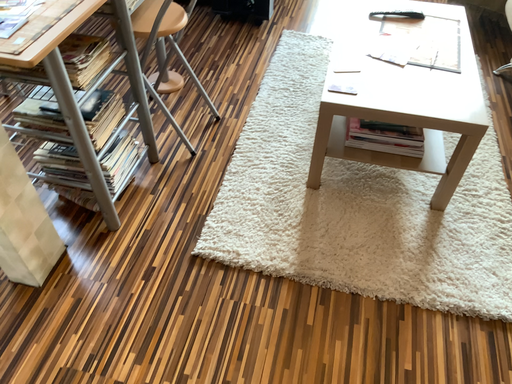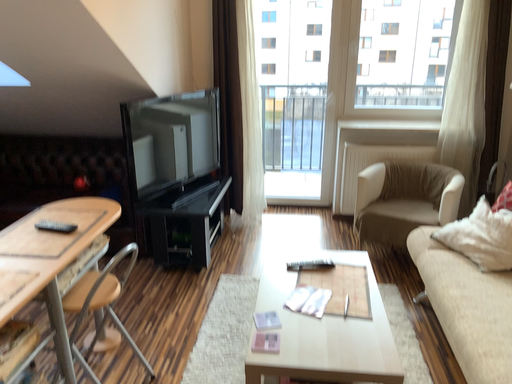
Question: Which way did the camera rotate in the video?

Choices:
 (A) rotated downward
 (B) rotated upward

Answer: (B)